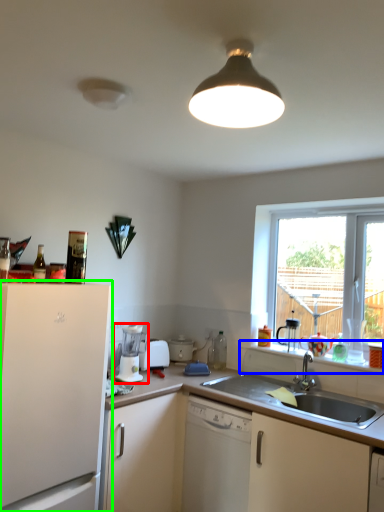
Question: Which is nearer to the coffee machine (highlighted by a red box)? window sill (highlighted by a blue box) or cabinetry (highlighted by a green box).

Choices:
 (A) window sill
 (B) cabinetry

Answer: (B)